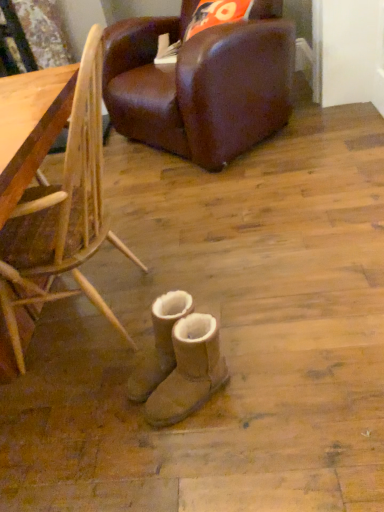
Question: Relative to bamboo chair at lower right, positioned as the 2th chair in top-to-bottom order, is tan suede boots at center, the 2th footwear positioned from the front, in front or behind?

Choices:
 (A) behind
 (B) front

Answer: (A)

Question: Would you say tan suede boots at center, which appears as the first footwear when viewed from the back, is inside or outside bamboo chair at lower right, which is the 1th chair in front-to-back order?

Choices:
 (A) outside
 (B) inside

Answer: (A)

Question: Which object is the farthest from the bamboo chair at lower right, which is the 1th chair in front-to-back order?

Choices:
 (A) brown leather chair at upper center, the 2th chair when ordered from front to back
 (B) tan suede boots at center, the second footwear in the back-to-front sequence
 (C) tan suede boots at center, which appears as the first footwear when viewed from the back

Answer: (A)

Question: Which object is positioned closest to the brown leather chair at upper center, arranged as the first chair when viewed from the top?

Choices:
 (A) bamboo chair at lower right, marked as the second chair in a back-to-front arrangement
 (B) tan suede boots at center, which appears as the first footwear when viewed from the back
 (C) tan suede boots at center, positioned as the first footwear in front-to-back order

Answer: (A)